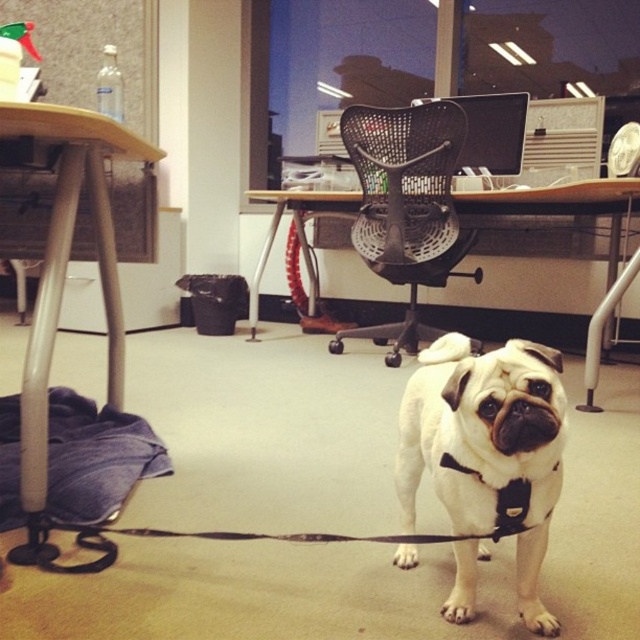
Which is more to the right, wooden desk at left or black mesh chair at center?

black mesh chair at center is more to the right.

Identify the location of wooden desk at left. The height and width of the screenshot is (640, 640). (64, 284).

The width and height of the screenshot is (640, 640). What do you see at coordinates (64, 284) in the screenshot?
I see `wooden desk at left` at bounding box center [64, 284].

Image resolution: width=640 pixels, height=640 pixels. I want to click on wooden desk at left, so [64, 284].

In order to click on white fur dog at center in this screenshot , I will do `click(486, 445)`.

Is white fur dog at center below black mesh chair at center?

Yes.

Is point (532, 536) in front of point (253, 196)?

Yes, point (532, 536) is in front of point (253, 196).

Where is `white fur dog at center`? white fur dog at center is located at coordinates (486, 445).

Who is positioned more to the right, white fur dog at center or wooden desk at left?

white fur dog at center is more to the right.

Which is below, white fur dog at center or wooden desk at left?

white fur dog at center is lower down.

Find the location of `white fur dog at center`. white fur dog at center is located at coordinates (486, 445).

The width and height of the screenshot is (640, 640). What are the coordinates of `white fur dog at center` in the screenshot? It's located at (486, 445).